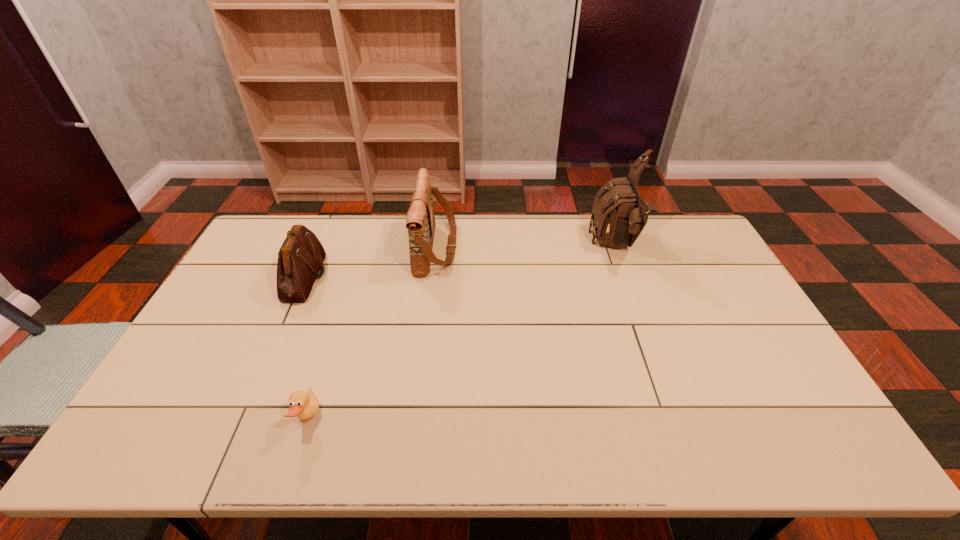
I want to click on the tallest shoulder bag, so click(619, 214).

Where is `the rightmost object`? The height and width of the screenshot is (540, 960). the rightmost object is located at coordinates (619, 214).

Where is `the second shoulder bag from right to left`? This screenshot has width=960, height=540. the second shoulder bag from right to left is located at coordinates (420, 221).

Where is `the third object from left to right`? This screenshot has height=540, width=960. the third object from left to right is located at coordinates [x=420, y=221].

I want to click on the shortest shoulder bag, so point(301,256).

Locate an element on the screen. the third tallest object is located at coordinates (301, 256).

Find the location of a particular element. the second object from left to right is located at coordinates (305, 405).

Locate an element on the screen. The height and width of the screenshot is (540, 960). the shortest object is located at coordinates [x=305, y=405].

Where is `vacant space located 0.320m on the front-facing side of the rightmost object`? The height and width of the screenshot is (540, 960). vacant space located 0.320m on the front-facing side of the rightmost object is located at coordinates (501, 246).

Where is `vacant region located on the front-facing side of the rightmost object`? The width and height of the screenshot is (960, 540). vacant region located on the front-facing side of the rightmost object is located at coordinates [x=577, y=246].